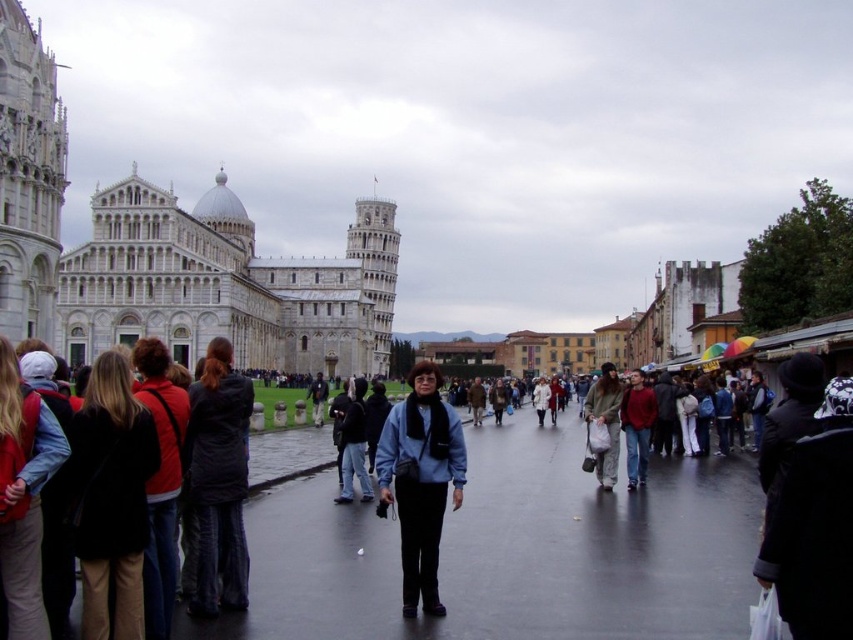
Does point (167, 584) come closer to viewer compared to point (627, 433)?

That is True.

In order to click on red fleece jacket at left in this screenshot , I will do click(160, 481).

Looking at this image, between dark blue fabric jacket at left and matte black jacket at left, which one appears on the right side from the viewer's perspective?

dark blue fabric jacket at left is more to the right.

Is dark blue fabric jacket at left further to the viewer compared to matte black jacket at left?

That is True.

Who is more forward, (x=242, y=406) or (x=4, y=600)?

Point (x=4, y=600)

The image size is (853, 640). What are the coordinates of `dark blue fabric jacket at left` in the screenshot? It's located at (218, 481).

Can you confirm if white stone cathedral at upper left is positioned to the left of matte black jacket at left?

Yes, white stone cathedral at upper left is to the left of matte black jacket at left.

Can you confirm if white stone cathedral at upper left is taller than matte black jacket at left?

Indeed, white stone cathedral at upper left has a greater height compared to matte black jacket at left.

Is point (294, 291) positioned before point (38, 458)?

No, (294, 291) is further to viewer.

Locate an element on the screen. Image resolution: width=853 pixels, height=640 pixels. white stone cathedral at upper left is located at coordinates (225, 284).